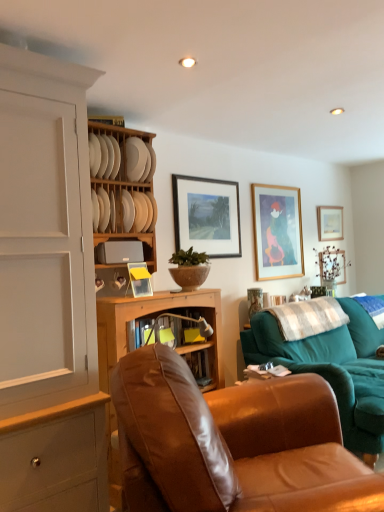
Question: Is point coord(231,252) closer or farther from the camera than point coord(279,327)?

Choices:
 (A) farther
 (B) closer

Answer: (A)

Question: From the image's perspective, is wooden-framed painting at center, which is the first picture frame from left to right, located above or below white checkered fabric at right, the first pillow from the front?

Choices:
 (A) above
 (B) below

Answer: (A)

Question: Which is nearer to the wooden-framed painting at center, positioned as the fourth picture frame in back-to-front order?

Choices:
 (A) gold-framed artwork at upper right, the 3th picture frame when ordered from back to front
 (B) white matte plate at upper center, the 1th plate in the bottom-to-top sequence
 (C) white soft pillow at right, arranged as the 1th pillow when viewed from the back
 (D) brown leather chair at center
 (E) white matte plate at upper center, arranged as the 1th plate when viewed from the top

Answer: (A)

Question: Estimate the real-world distances between objects in this image. Which object is farther from the white matte plate at upper center, acting as the second plate starting from the bottom?

Choices:
 (A) white matte plate at upper center, acting as the 2th plate starting from the top
 (B) teal fabric couch at right
 (C) gold-framed artwork at upper right, which appears as the third picture frame when viewed from the right
 (D) white checkered fabric at right, the 2th pillow from the right
 (E) brown leather chair at center

Answer: (B)